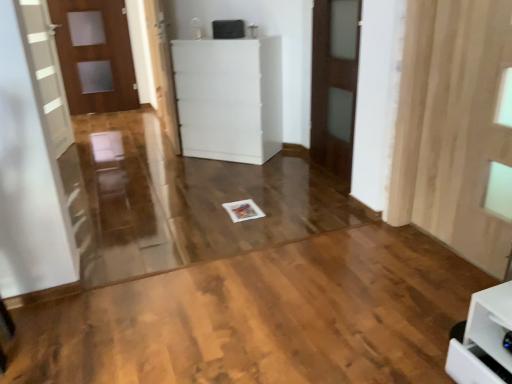
Where is `brown wooden door at center, which is counted as the 3th door, starting from the back`? The image size is (512, 384). brown wooden door at center, which is counted as the 3th door, starting from the back is located at coordinates (334, 83).

This screenshot has width=512, height=384. I want to click on black plastic speaker at upper center, so click(x=228, y=29).

Identify the location of matte wooden door at left, the first door viewed from the back. The height and width of the screenshot is (384, 512). (95, 55).

From the image's perspective, does black plastic speaker at upper center appear lower than wooden curtain at right?

No.

Can you confirm if black plastic speaker at upper center is positioned to the right of wooden curtain at right?

Incorrect, black plastic speaker at upper center is not on the right side of wooden curtain at right.

Can you tell me how much black plastic speaker at upper center and wooden curtain at right differ in facing direction?

The angle between the facing direction of black plastic speaker at upper center and the facing direction of wooden curtain at right is 46.1 degrees.

Is black plastic speaker at upper center taller than wooden curtain at right?

Incorrect, the height of black plastic speaker at upper center is not larger of that of wooden curtain at right.

From the image's perspective, is white plastic cabinet at center located beneath natural wood floor at center?

No, from the image's perspective, white plastic cabinet at center is not beneath natural wood floor at center.

In terms of width, does white plastic cabinet at center look wider or thinner when compared to natural wood floor at center?

white plastic cabinet at center is thinner than natural wood floor at center.

Considering the sizes of objects white plastic cabinet at center and natural wood floor at center in the image provided, who is shorter, white plastic cabinet at center or natural wood floor at center?

natural wood floor at center.

From the image's perspective, which object appears higher, wooden curtain at right or natural wood floor at center?

From the image's view, wooden curtain at right is above.

Is there a large distance between wooden curtain at right and natural wood floor at center?

No, wooden curtain at right is not far from natural wood floor at center.

Does wooden curtain at right turn towards natural wood floor at center?

Yes, wooden curtain at right faces towards natural wood floor at center.

Find the location of a particular element. The image size is (512, 384). curtain located above the natural wood floor at center (from a real-world perspective) is located at coordinates (456, 128).

I want to click on plywood on the right of matte wooden door at left, the first door viewed from the back, so (262, 317).

Can you confirm if matte wooden door at left, the first door viewed from the back, is wider than natural wood floor at center?

Incorrect, the width of matte wooden door at left, the first door viewed from the back, does not surpass that of natural wood floor at center.

Can you confirm if matte wooden door at left, the first door viewed from the back, is shorter than natural wood floor at center?

No, matte wooden door at left, the first door viewed from the back, is not shorter than natural wood floor at center.

From a real-world perspective, between matte wooden door at left, positioned as the third door in right-to-left order, and natural wood floor at center, who is vertically lower?

natural wood floor at center.

Is white glossy door at center, which is the 2th door in front-to-back order, located within white plastic cabinet at center?

Definitely not — white glossy door at center, which is the 2th door in front-to-back order, is not inside white plastic cabinet at center.

Is white plastic cabinet at center positioned with its back to white glossy door at center, the second door from the left?

white plastic cabinet at center does not have its back to white glossy door at center, the second door from the left.

From a real-world perspective, is white plastic cabinet at center located beneath white glossy door at center, which is the 2th door in front-to-back order?

Indeed, from a real-world perspective, white plastic cabinet at center is positioned beneath white glossy door at center, which is the 2th door in front-to-back order.

Which of these two, white plastic cabinet at center or white glossy door at center, positioned as the second door in right-to-left order, is bigger?

Bigger between the two is white plastic cabinet at center.

From their relative heights in the image, would you say black plastic speaker at upper center is taller or shorter than matte wooden door at left, the 3th door from the front?

black plastic speaker at upper center is shorter than matte wooden door at left, the 3th door from the front.

Is black plastic speaker at upper center in front of or behind matte wooden door at left, marked as the 1th door in a left-to-right arrangement, in the image?

In the image, black plastic speaker at upper center appears in front of matte wooden door at left, marked as the 1th door in a left-to-right arrangement.

From the image's perspective, would you say black plastic speaker at upper center is positioned over matte wooden door at left, the 3th door from the front?

No, from the image's perspective, black plastic speaker at upper center is not on top of matte wooden door at left, the 3th door from the front.

From the picture: Visually, is white plastic cabinet at center positioned to the left or to the right of brown wooden door at center, the first door when ordered from right to left?

Based on their positions, white plastic cabinet at center is located to the left of brown wooden door at center, the first door when ordered from right to left.

From the image's perspective, which object appears higher, white plastic cabinet at center or brown wooden door at center, the first door viewed from the front?

white plastic cabinet at center.

Is white plastic cabinet at center turned away from brown wooden door at center, the first door when ordered from right to left?

No, white plastic cabinet at center's orientation is not away from brown wooden door at center, the first door when ordered from right to left.

Does white plastic cabinet at center lie behind brown wooden door at center, the first door viewed from the front?

Yes, white plastic cabinet at center is further from the camera.

This screenshot has height=384, width=512. Find the location of `curtain on the right of black plastic speaker at upper center`. curtain on the right of black plastic speaker at upper center is located at coordinates (456, 128).

In the image, there is a natural wood floor at center. Where is `furniture above it (from the image's perspective)`? furniture above it (from the image's perspective) is located at coordinates [x=229, y=98].

When comparing their distances from white glossy door at center, the second door from the left, does natural wood floor at center or matte wooden door at left, positioned as the third door in right-to-left order, seem further?

natural wood floor at center is further to white glossy door at center, the second door from the left.

Considering their positions, is white glossy door at center, positioned as the second door in right-to-left order, positioned closer to brown wooden door at center, acting as the third door starting from the left, than black plastic speaker at upper center?

black plastic speaker at upper center lies closer to brown wooden door at center, acting as the third door starting from the left, than the other object.

From the image, which object appears to be farther from wooden curtain at right, matte wooden door at left, the 3th door from the front, or brown wooden door at center, the first door when ordered from right to left?

The object further to wooden curtain at right is matte wooden door at left, the 3th door from the front.

Considering their positions, is brown wooden door at center, the first door when ordered from right to left, positioned further to black plastic speaker at upper center than wooden curtain at right?

wooden curtain at right is further to black plastic speaker at upper center.

When comparing their distances from brown wooden door at center, the first door when ordered from right to left, does natural wood floor at center or white plastic cabinet at center seem closer?

The object closer to brown wooden door at center, the first door when ordered from right to left, is white plastic cabinet at center.

In the scene shown: Based on their spatial positions, is brown wooden door at center, the first door viewed from the front, or white plastic cabinet at center closer to natural wood floor at center?

Among the two, brown wooden door at center, the first door viewed from the front, is located nearer to natural wood floor at center.

From the image, which object appears to be nearer to brown wooden door at center, the first door viewed from the front, white glossy door at center, positioned as the second door in right-to-left order, or natural wood floor at center?

white glossy door at center, positioned as the second door in right-to-left order, lies closer to brown wooden door at center, the first door viewed from the front, than the other object.

Estimate the real-world distances between objects in this image. Which object is closer to natural wood floor at center, white plastic cabinet at center or wooden curtain at right?

Based on the image, wooden curtain at right appears to be nearer to natural wood floor at center.

Identify the location of door located between matte wooden door at left, the 3th door from the front, and brown wooden door at center, the first door when ordered from right to left, in the left-right direction. This screenshot has height=384, width=512. (162, 71).

Where is `door between matte wooden door at left, positioned as the third door in right-to-left order, and black plastic speaker at upper center from left to right`? This screenshot has height=384, width=512. door between matte wooden door at left, positioned as the third door in right-to-left order, and black plastic speaker at upper center from left to right is located at coordinates (162, 71).

In order to click on curtain located between natural wood floor at center and white plastic cabinet at center in the depth direction in this screenshot , I will do `click(456, 128)`.

Identify the location of furniture located between natural wood floor at center and black plastic speaker at upper center in the depth direction. This screenshot has width=512, height=384. (229, 98).